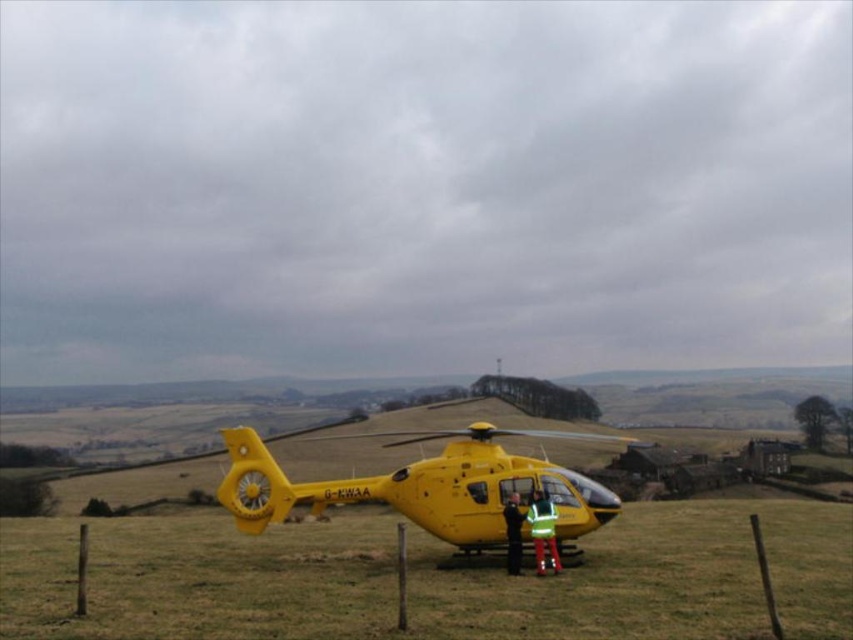
Question: Does yellow matte helicopter at center have a greater width compared to reflective green vest at center?

Choices:
 (A) no
 (B) yes

Answer: (B)

Question: Estimate the real-world distances between objects in this image. Which object is farther from the reflective green vest at center?

Choices:
 (A) yellow matte helicopter at center
 (B) matte yellow helicopter at center
 (C) reflective yellow jacket at center

Answer: (A)

Question: Is yellow matte helicopter at center below reflective yellow jacket at center?

Choices:
 (A) yes
 (B) no

Answer: (A)

Question: Which point is farther from the camera taking this photo?

Choices:
 (A) [x=550, y=515]
 (B) [x=517, y=513]
 (C) [x=498, y=531]

Answer: (C)

Question: Can you confirm if reflective yellow jacket at center is smaller than reflective green vest at center?

Choices:
 (A) yes
 (B) no

Answer: (B)

Question: Which point is closer to the camera taking this photo?

Choices:
 (A) (538, 547)
 (B) (519, 513)

Answer: (A)